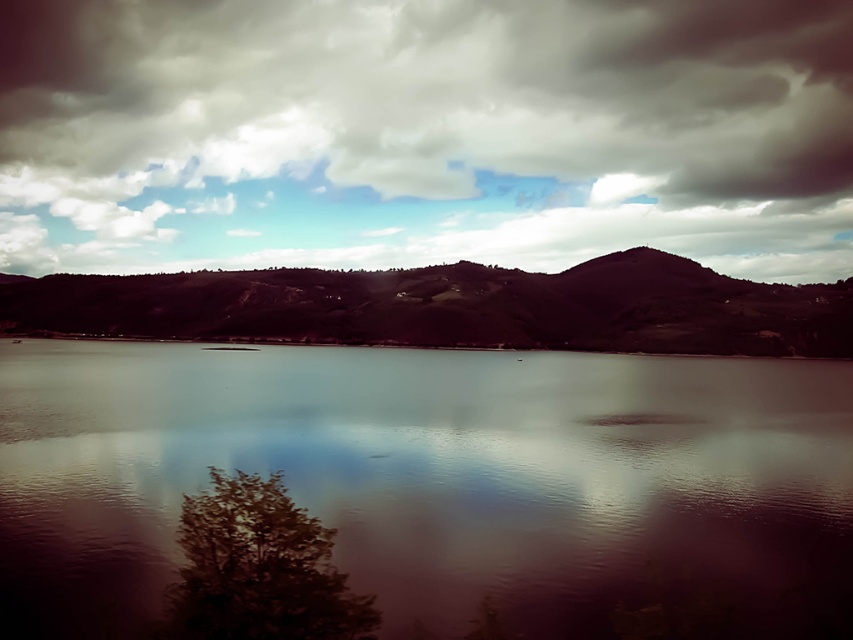
Does cloudy sky at upper center appear over dark brown textured hill at center?

Yes.

Is cloudy sky at upper center further to the viewer compared to dark brown textured hill at center?

Yes, cloudy sky at upper center is further from the viewer.

At what (x,y) coordinates should I click in order to perform the action: click on cloudy sky at upper center. Please return your answer as a coordinate pair (x, y). The image size is (853, 640). Looking at the image, I should click on (424, 132).

Find the location of a particular element. cloudy sky at upper center is located at coordinates (x=424, y=132).

Is smooth water at center to the left of dark brown textured hill at center from the viewer's perspective?

In fact, smooth water at center is to the right of dark brown textured hill at center.

Is smooth water at center wider than dark brown textured hill at center?

Incorrect, smooth water at center's width does not surpass dark brown textured hill at center's.

Where is `smooth water at center`? This screenshot has width=853, height=640. smooth water at center is located at coordinates (434, 481).

Can you confirm if cloudy sky at upper center is shorter than smooth water at center?

Incorrect, cloudy sky at upper center's height does not fall short of smooth water at center's.

Is cloudy sky at upper center below smooth water at center?

Actually, cloudy sky at upper center is above smooth water at center.

Measure the distance between cloudy sky at upper center and camera.

cloudy sky at upper center and camera are 558.02 meters apart from each other.

Locate an element on the screen. This screenshot has height=640, width=853. cloudy sky at upper center is located at coordinates (424, 132).